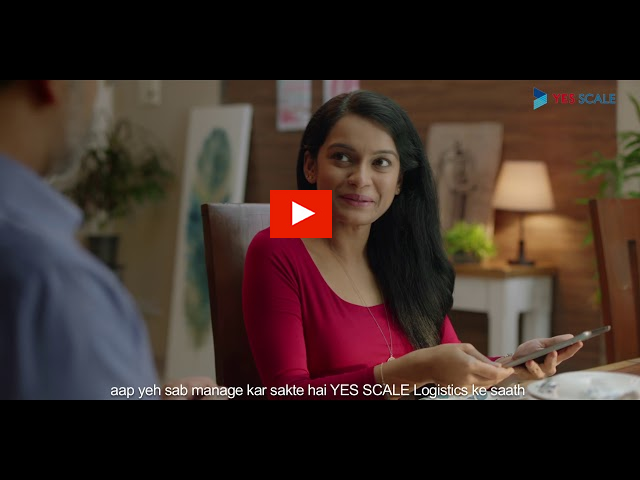
This screenshot has width=640, height=480. I want to click on painting canvas leaning against wall, so click(x=211, y=151).